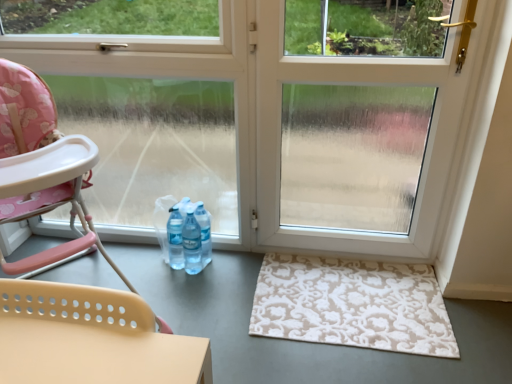
Question: Is pink fabric highchair at left to the left of transparent plastic screen door at center from the viewer's perspective?

Choices:
 (A) yes
 (B) no

Answer: (A)

Question: Is the position of pink fabric highchair at left less distant than that of transparent plastic screen door at center?

Choices:
 (A) no
 (B) yes

Answer: (B)

Question: From a real-world perspective, is pink fabric highchair at left under transparent plastic screen door at center?

Choices:
 (A) no
 (B) yes

Answer: (B)

Question: Considering the relative sizes of pink fabric highchair at left and transparent plastic screen door at center in the image provided, is pink fabric highchair at left smaller than transparent plastic screen door at center?

Choices:
 (A) no
 (B) yes

Answer: (A)

Question: Are pink fabric highchair at left and transparent plastic screen door at center making contact?

Choices:
 (A) no
 (B) yes

Answer: (A)

Question: From a real-world perspective, relative to beige floral rug at lower right, is pink fabric highchair at left vertically above or below?

Choices:
 (A) above
 (B) below

Answer: (A)

Question: Looking at their shapes, would you say pink fabric highchair at left is wider or thinner than beige floral rug at lower right?

Choices:
 (A) thin
 (B) wide

Answer: (B)

Question: Does point (52, 107) appear closer or farther from the camera than point (400, 296)?

Choices:
 (A) farther
 (B) closer

Answer: (B)

Question: From the image's perspective, is pink fabric highchair at left positioned above or below beige floral rug at lower right?

Choices:
 (A) above
 (B) below

Answer: (A)

Question: Is transparent plastic screen door at center in front of or behind pink fabric highchair at left in the image?

Choices:
 (A) behind
 (B) front

Answer: (A)

Question: In terms of height, does transparent plastic screen door at center look taller or shorter compared to pink fabric highchair at left?

Choices:
 (A) tall
 (B) short

Answer: (A)

Question: Is transparent plastic screen door at center wider or thinner than pink fabric highchair at left?

Choices:
 (A) thin
 (B) wide

Answer: (A)

Question: From the image's perspective, is transparent plastic screen door at center located above or below pink fabric highchair at left?

Choices:
 (A) below
 (B) above

Answer: (B)

Question: Choose the correct answer: Is clear glass window at left inside transparent plastic screen door at center or outside it?

Choices:
 (A) inside
 (B) outside

Answer: (B)

Question: From the image's perspective, is clear glass window at left positioned above or below transparent plastic screen door at center?

Choices:
 (A) above
 (B) below

Answer: (A)